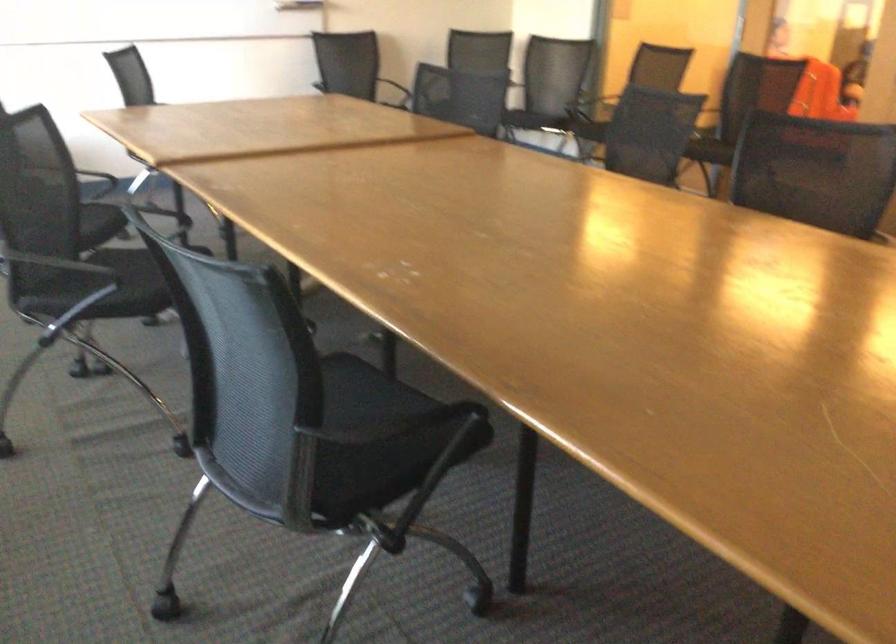
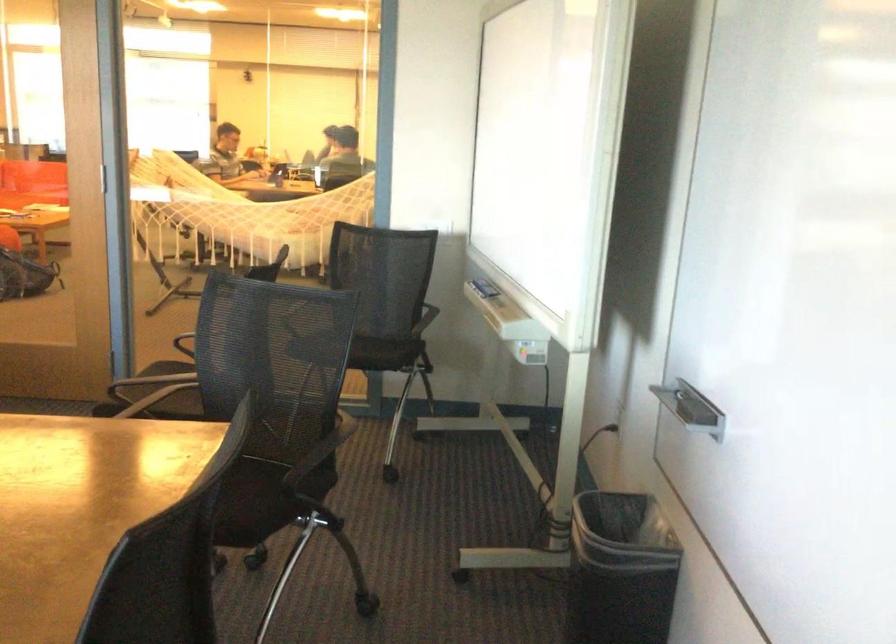
Question: The camera is either moving clockwise (left) or counter-clockwise (right) around the object. The first image is from the beginning of the video and the second image is from the end. Is the camera moving left or right when shooting the video?

Choices:
 (A) Left
 (B) Right

Answer: (A)